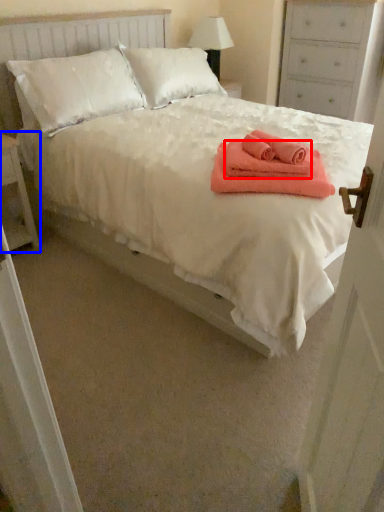
Question: Which object appears farthest to the camera in this image, cloth (highlighted by a red box) or nightstand (highlighted by a blue box)?

Choices:
 (A) cloth
 (B) nightstand

Answer: (B)